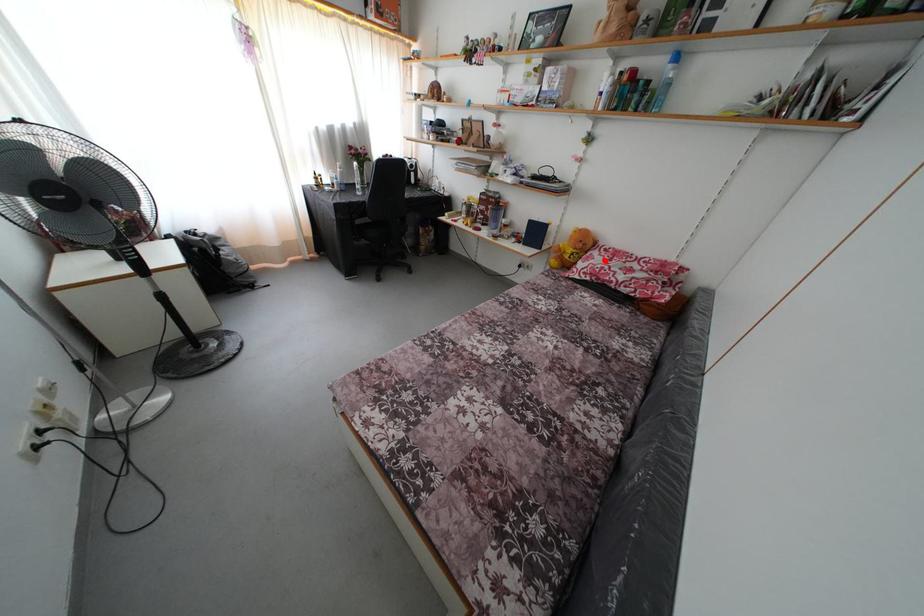
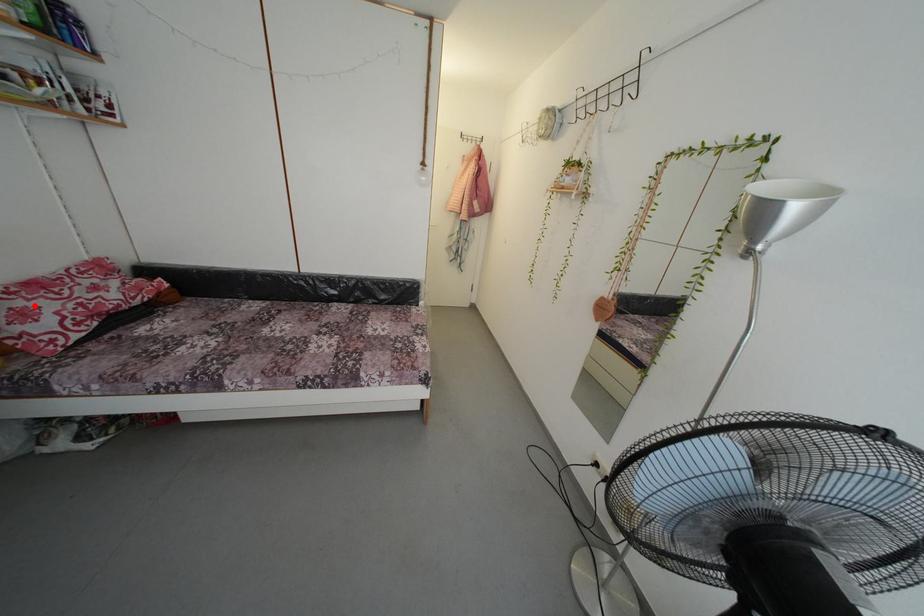
I am providing you with two images of the same scene from different viewpoints. A red point is marked on the first image and another point is marked on the second image. Do the highlighted points in image1 and image2 indicate the same real-world spot?

Yes